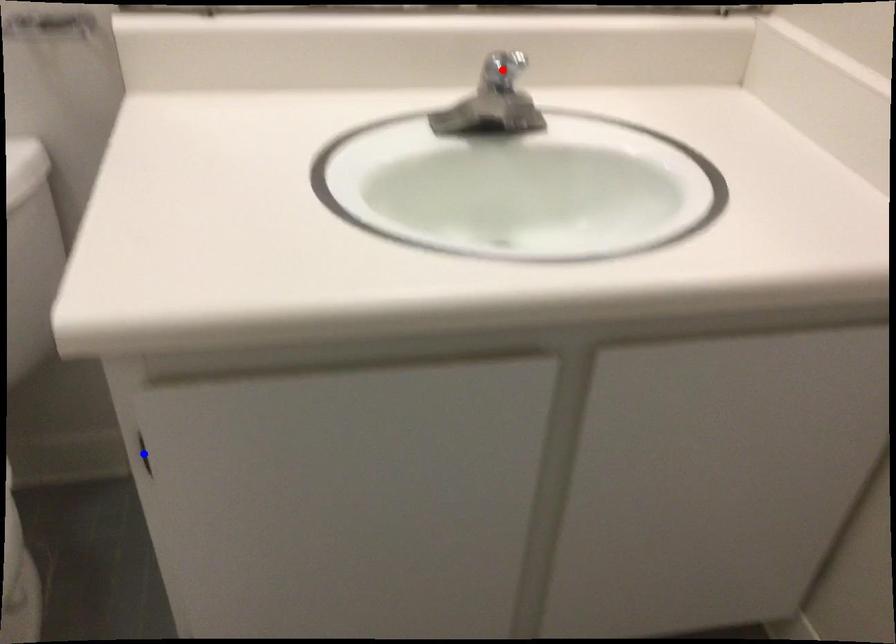
Question: Which of the two points in the image is closer to the camera?

Choices:
 (A) Blue point is closer.
 (B) Red point is closer.

Answer: (A)